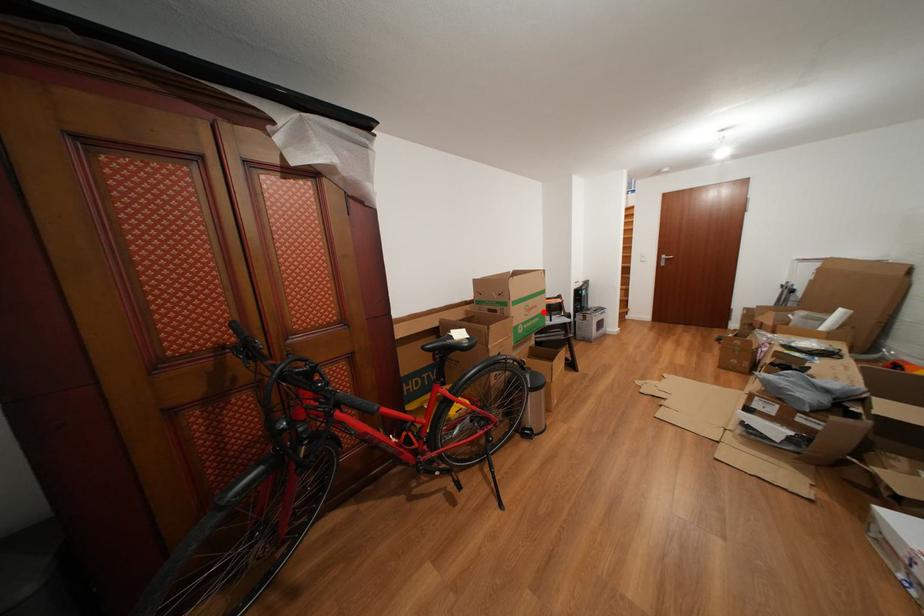
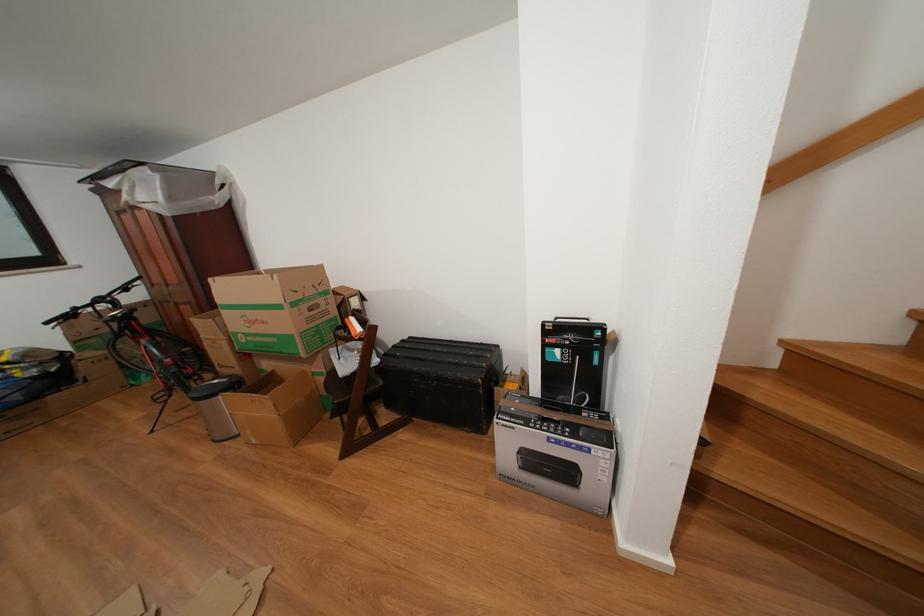
The point at the highlighted location is marked in the first image. Where is the corresponding point in the second image?

(272, 328)